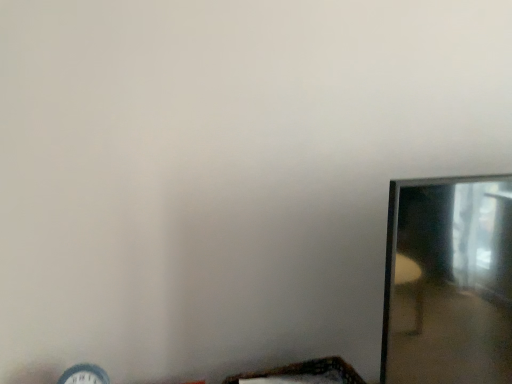
Question: Is clear glass mirror at right positioned with its back to matte white clock at lower left?

Choices:
 (A) yes
 (B) no

Answer: (B)

Question: From the image's perspective, is clear glass mirror at right over matte white clock at lower left?

Choices:
 (A) yes
 (B) no

Answer: (A)

Question: Is matte white clock at lower left surrounded by clear glass mirror at right?

Choices:
 (A) yes
 (B) no

Answer: (B)

Question: Can you confirm if clear glass mirror at right is thinner than matte white clock at lower left?

Choices:
 (A) no
 (B) yes

Answer: (A)

Question: Are clear glass mirror at right and matte white clock at lower left located far from each other?

Choices:
 (A) no
 (B) yes

Answer: (A)

Question: Looking at the image, does clear glass mirror at right seem bigger or smaller compared to wooden woven basket at lower center?

Choices:
 (A) small
 (B) big

Answer: (B)

Question: From a real-world perspective, relative to wooden woven basket at lower center, is clear glass mirror at right vertically above or below?

Choices:
 (A) above
 (B) below

Answer: (A)

Question: Is point (396, 228) closer or farther from the camera than point (330, 372)?

Choices:
 (A) farther
 (B) closer

Answer: (B)

Question: Considering the positions of clear glass mirror at right and wooden woven basket at lower center in the image, is clear glass mirror at right taller or shorter than wooden woven basket at lower center?

Choices:
 (A) short
 (B) tall

Answer: (B)

Question: From a real-world perspective, is clear glass mirror at right positioned above or below matte white clock at lower left?

Choices:
 (A) below
 (B) above

Answer: (B)

Question: Is point (431, 344) positioned closer to the camera than point (74, 377)?

Choices:
 (A) closer
 (B) farther

Answer: (A)

Question: Would you say clear glass mirror at right is inside or outside matte white clock at lower left?

Choices:
 (A) outside
 (B) inside

Answer: (A)

Question: In terms of height, does clear glass mirror at right look taller or shorter compared to matte white clock at lower left?

Choices:
 (A) short
 (B) tall

Answer: (B)

Question: Is point (365, 382) positioned closer to the camera than point (488, 200)?

Choices:
 (A) farther
 (B) closer

Answer: (A)

Question: Looking at their shapes, would you say wooden woven basket at lower center is wider or thinner than clear glass mirror at right?

Choices:
 (A) thin
 (B) wide

Answer: (A)